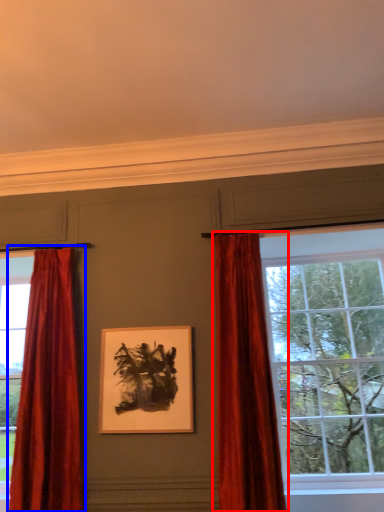
Question: Which of the following is the farthest to the observer, curtain (highlighted by a red box) or curtain (highlighted by a blue box)?

Choices:
 (A) curtain
 (B) curtain

Answer: (B)